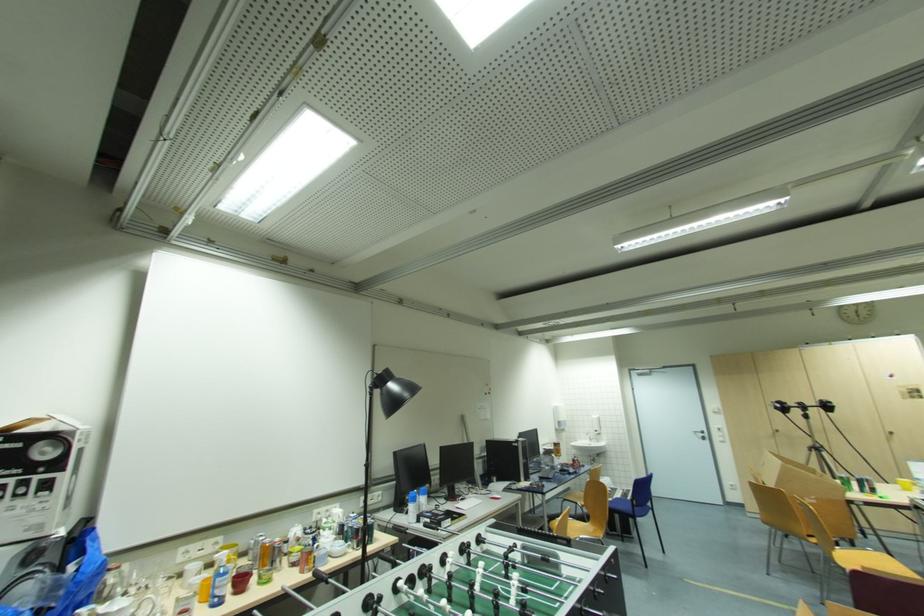
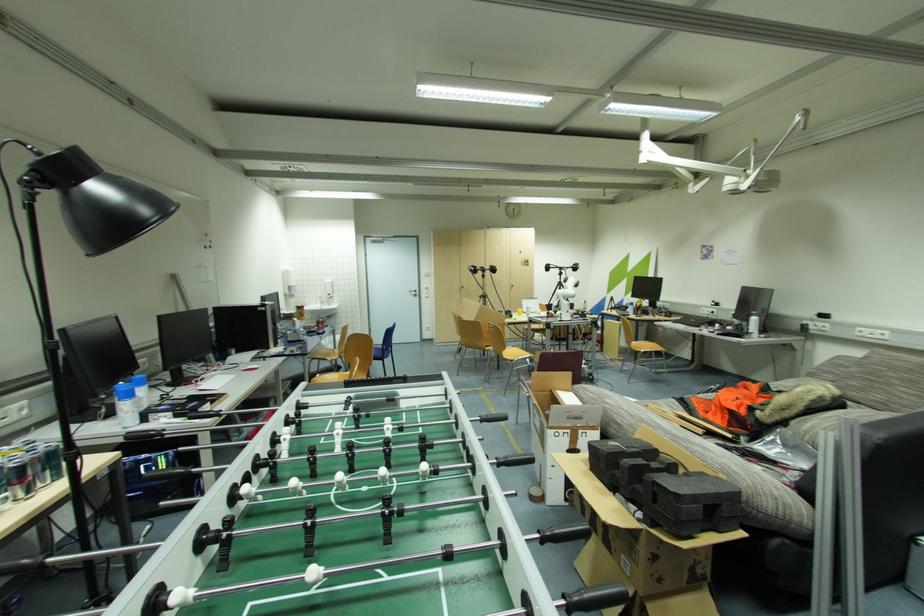
In the scene shown: The images are taken continuously from a first-person perspective. In which direction is your viewpoint rotating?

The camera's rotation is toward right-down.